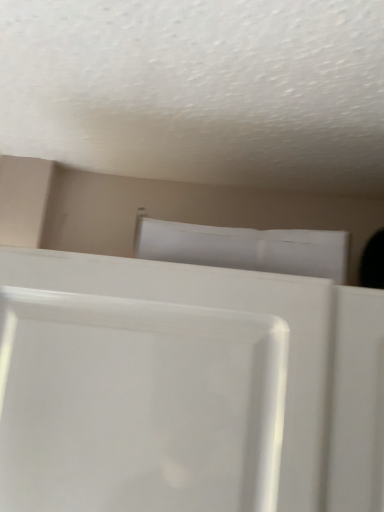
What do you see at coordinates (244, 248) in the screenshot? The height and width of the screenshot is (512, 384). I see `white fabric pillow at upper center` at bounding box center [244, 248].

Where is `white fabric pillow at upper center`? white fabric pillow at upper center is located at coordinates (244, 248).

This screenshot has height=512, width=384. What are the coordinates of `white fabric pillow at upper center` in the screenshot? It's located at (244, 248).